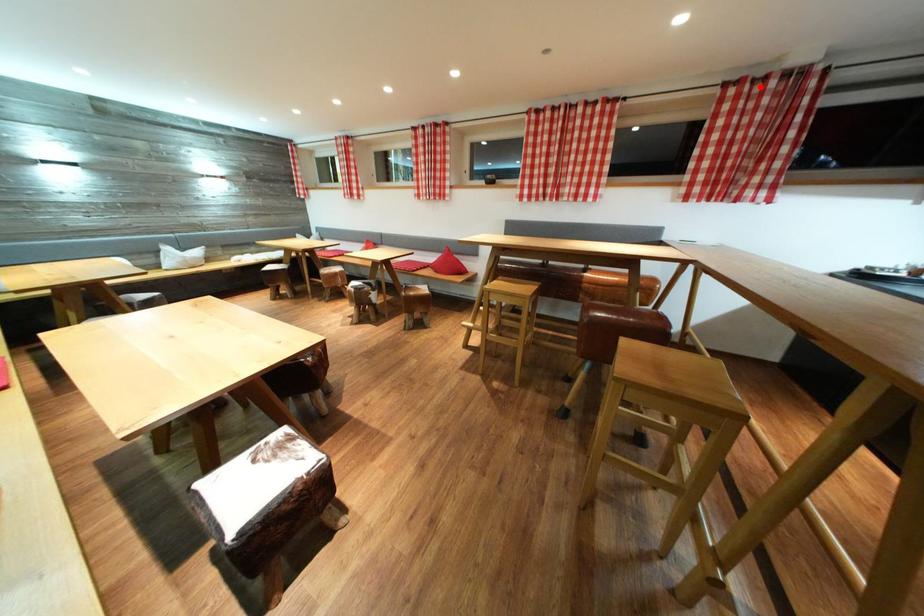
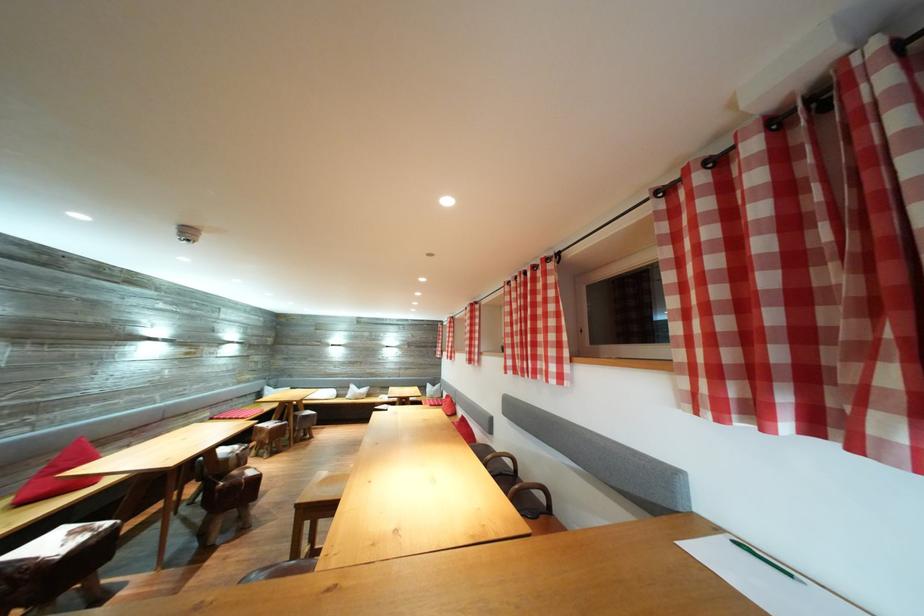
Where in the second image is the point corresponding to the highlighted location from the first image?

(725, 166)